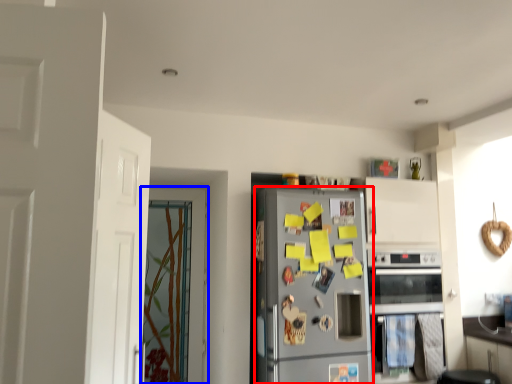
Question: Which object is closer to the camera taking this photo, refrigerator (highlighted by a red box) or door (highlighted by a blue box)?

Choices:
 (A) refrigerator
 (B) door

Answer: (A)